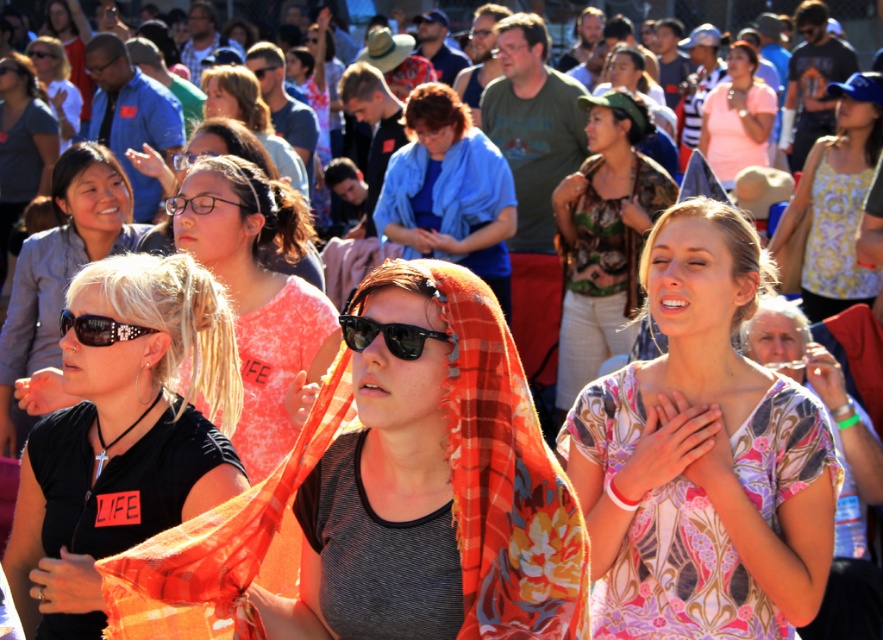
Question: Can you confirm if black plastic sunglasses at left is positioned below black plastic goggles at upper left?

Choices:
 (A) yes
 (B) no

Answer: (A)

Question: Which point is closer to the camera?

Choices:
 (A) (406, 189)
 (B) (46, 48)

Answer: (A)

Question: Estimate the real-world distances between objects in this image. Which object is closer to the blue cotton shirt at center?

Choices:
 (A) matte blue shirt at upper left
 (B) pink fabric scarf at center
 (C) black matte sunglasses at lower left
 (D) matte black glasses at upper center

Answer: (D)

Question: Which of these objects is positioned farthest from the pink fabric scarf at center?

Choices:
 (A) floral-patterned blouse at center
 (B) black plastic sunglasses at left

Answer: (A)

Question: Can you confirm if orange plaid shawl at center is wider than pink fabric scarf at center?

Choices:
 (A) yes
 (B) no

Answer: (B)

Question: Is blue cotton shirt at center behind black plastic glasses at center?

Choices:
 (A) yes
 (B) no

Answer: (A)